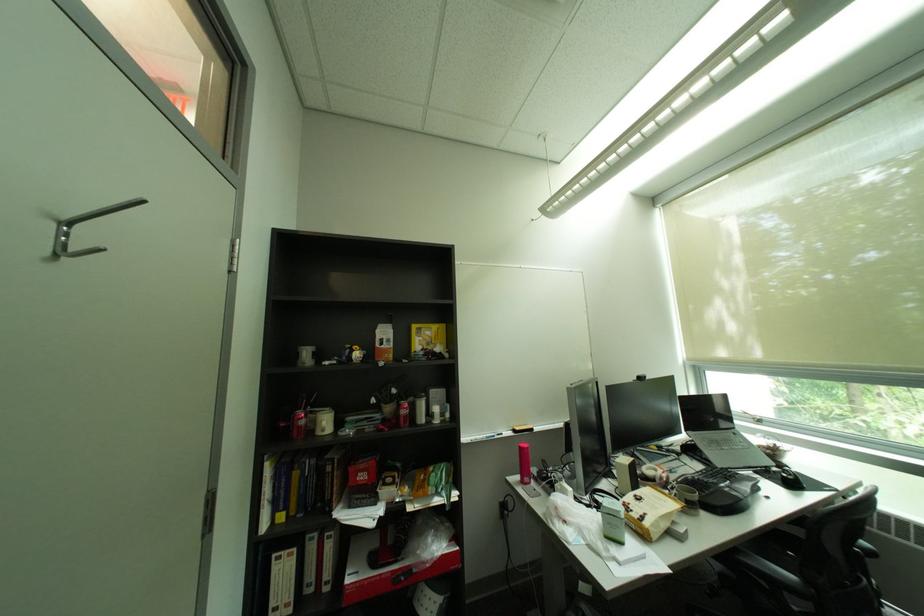
This screenshot has height=616, width=924. Find the location of `door hook`. door hook is located at coordinates (86, 228).